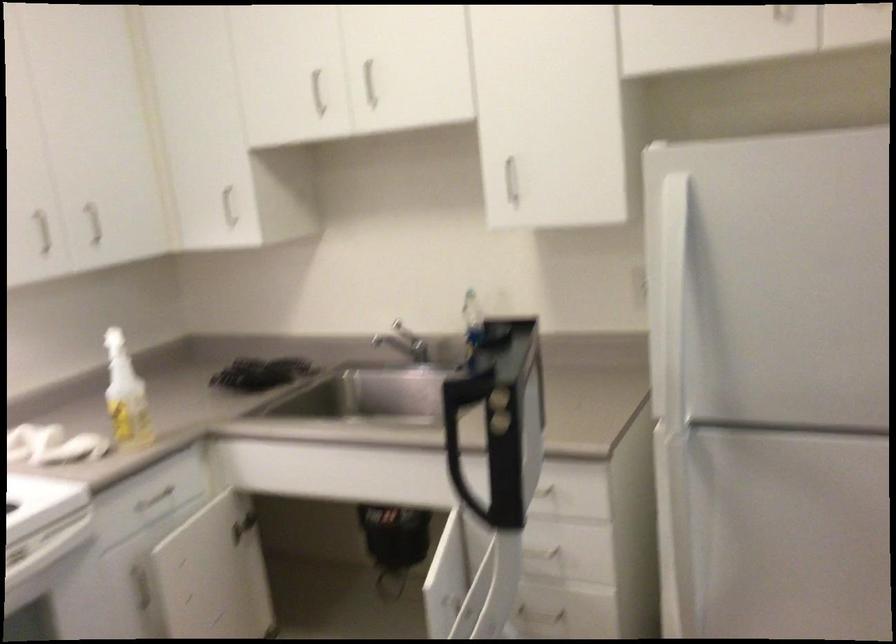
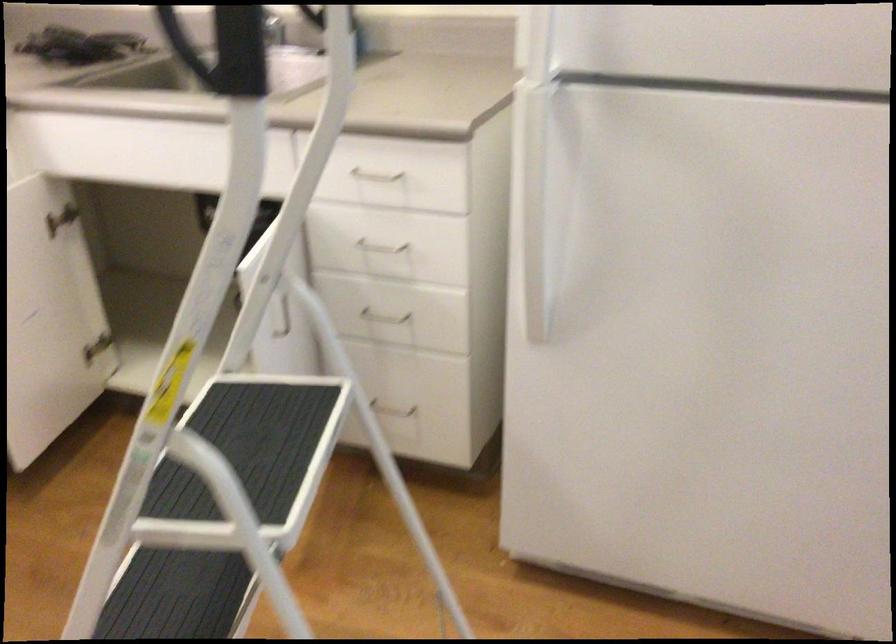
Find the pixel in the second image that matches (x=672, y=518) in the first image.

(530, 203)